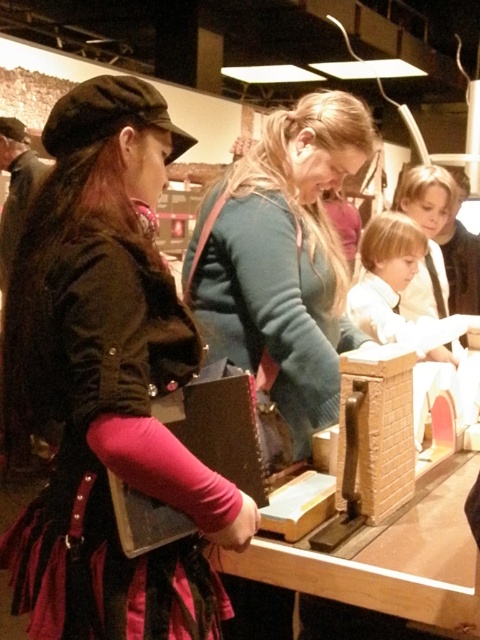
Question: Is velvet black jacket at center positioned at the back of wooden table at center?

Choices:
 (A) yes
 (B) no

Answer: (B)

Question: Which point appears farthest from the camera in this image?

Choices:
 (A) (374, 605)
 (B) (67, 400)
 (C) (327, 406)

Answer: (C)

Question: Is velvet black jacket at center positioned at the back of wooden table at center?

Choices:
 (A) no
 (B) yes

Answer: (A)

Question: Is velvet black jacket at center closer to the viewer compared to wooden table at center?

Choices:
 (A) no
 (B) yes

Answer: (B)

Question: Which of the following is the closest to the observer?

Choices:
 (A) velvet black jacket at center
 (B) wooden table at center
 (C) teal sweater at center

Answer: (A)

Question: Which object is farther from the camera taking this photo?

Choices:
 (A) wooden table at center
 (B) velvet black jacket at center

Answer: (A)